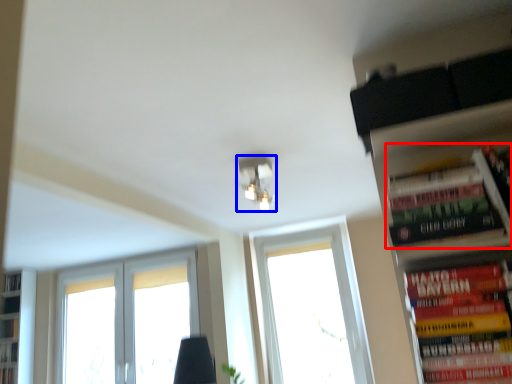
Question: Among these objects, which one is farthest to the camera, book (highlighted by a red box) or light fixture (highlighted by a blue box)?

Choices:
 (A) book
 (B) light fixture

Answer: (B)